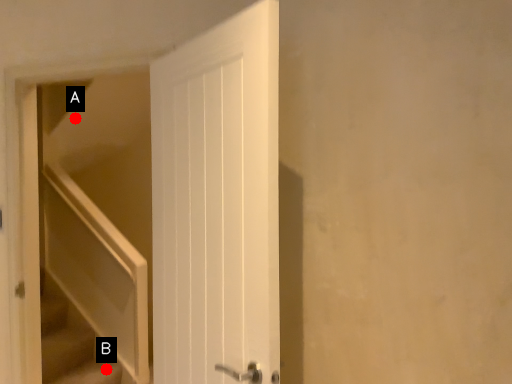
Question: Two points are circled on the image, labeled by A and B beside each circle. Which point is farther to the camera?

Choices:
 (A) A is further
 (B) B is further

Answer: (A)